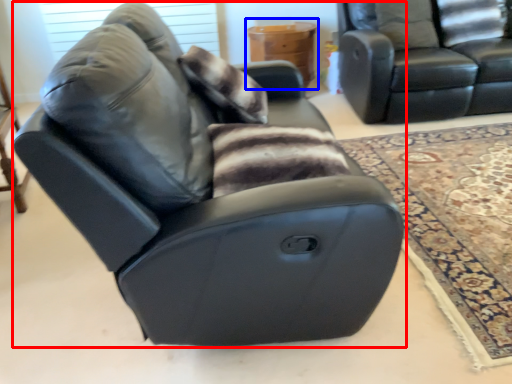
Question: Among these objects, which one is farthest to the camera, chair (highlighted by a red box) or table (highlighted by a blue box)?

Choices:
 (A) chair
 (B) table

Answer: (B)